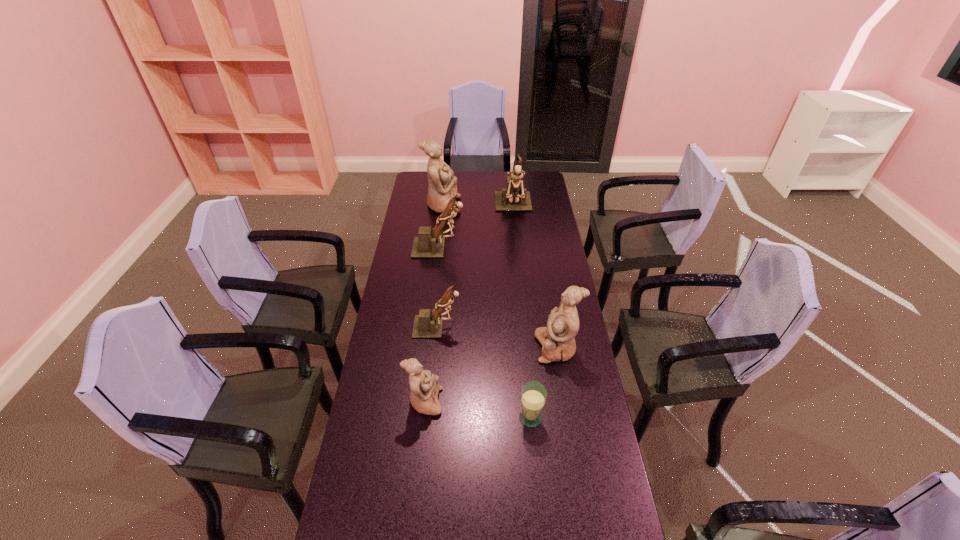
Find the location of a particular element. Image resolution: width=960 pixels, height=540 pixels. vacant space situated 0.060m on the right of the blue glass is located at coordinates (562, 417).

At what (x,y) coordinates should I click in order to perform the action: click on vacant position at the far edge of the desktop. Please return your answer as a coordinate pair (x, y). Looking at the image, I should click on (453, 176).

In the image, there is a desktop. Identify the location of vacant space at the left edge. The width and height of the screenshot is (960, 540). (406, 223).

In the image, there is a desktop. Find the location of `free space at the right edge`. free space at the right edge is located at coordinates (539, 264).

Locate an element on the screen. vacant area that lies between the glass and the third farthest object is located at coordinates (485, 333).

At what (x,y) coordinates should I click in order to perform the action: click on free spot between the second nearest white figurine and the nearest brown figurine. Please return your answer as a coordinate pair (x, y). The width and height of the screenshot is (960, 540). Looking at the image, I should click on (497, 338).

You are a GUI agent. You are given a task and a screenshot of the screen. Output one action in this format:
    pyautogui.click(x=<x>, y=<y>)
    Task: Click on the free point between the nearest brown figurine and the biggest brown figurine
    The width and height of the screenshot is (960, 540).
    Given the screenshot: What is the action you would take?
    (x=475, y=267)

Locate an element on the screen. This screenshot has height=540, width=960. free space between the glass and the biggest white figurine is located at coordinates (487, 312).

The width and height of the screenshot is (960, 540). I want to click on object that is the second closest to the glass, so click(424, 385).

Identify the location of object that is the sixth nearest to the nearest figurine. (442, 187).